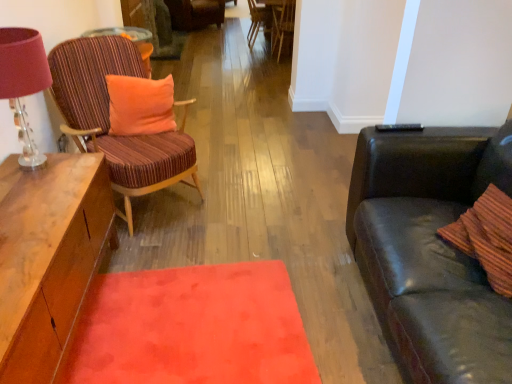
Describe the element at coordinates (195, 13) in the screenshot. I see `velvet striped chair at center, acting as the 1th chair starting from the back` at that location.

You are a GUI agent. You are given a task and a screenshot of the screen. Output one action in this format:
    pyautogui.click(x=<x>, y=<y>)
    Task: Click on the matte wood desk at upper left
    
    Given the screenshot: What is the action you would take?
    coord(130,40)

This screenshot has width=512, height=384. Describe the element at coordinates (109, 120) in the screenshot. I see `striped fabric chair at left, the 4th chair when ordered from back to front` at that location.

The height and width of the screenshot is (384, 512). What do you see at coordinates (140, 105) in the screenshot?
I see `orange plush pillow at left` at bounding box center [140, 105].

This screenshot has height=384, width=512. I want to click on orange plush pillow at left, so click(x=140, y=105).

Locate an element on the screen. The width and height of the screenshot is (512, 384). velvety orange mat at center is located at coordinates (193, 328).

In the scene shown: Does matte pink lampshade at left have a smaller size compared to wooden chair at center, marked as the 3th chair in a bottom-to-top arrangement?

Correct, matte pink lampshade at left occupies less space than wooden chair at center, marked as the 3th chair in a bottom-to-top arrangement.

Considering the sizes of matte pink lampshade at left and wooden chair at center, the second chair viewed from the top, in the image, is matte pink lampshade at left wider or thinner than wooden chair at center, the second chair viewed from the top,?

In the image, matte pink lampshade at left appears to be more narrow than wooden chair at center, the second chair viewed from the top.

How many degrees apart are the facing directions of matte pink lampshade at left and wooden chair at center, the second chair viewed from the top?

The angle between the facing direction of matte pink lampshade at left and the facing direction of wooden chair at center, the second chair viewed from the top, is 0.418 degrees.

Considering the sizes of objects matte pink lampshade at left and wooden chair at center, the second chair viewed from the top, in the image provided, who is taller, matte pink lampshade at left or wooden chair at center, the second chair viewed from the top,?

wooden chair at center, the second chair viewed from the top, is taller.

Which point is more forward, (119, 143) or (165, 126)?

Positioned in front is point (119, 143).

Find the location of `chair in front of the orange plush pillow at left`. chair in front of the orange plush pillow at left is located at coordinates (109, 120).

From a real-world perspective, is striped fabric chair at left, the 4th chair when ordered from top to bottom, above or below orange plush pillow at left?

From a real-world perspective, striped fabric chair at left, the 4th chair when ordered from top to bottom, is physically below orange plush pillow at left.

Is striped fabric chair at left, the 4th chair when ordered from top to bottom, with orange plush pillow at left?

No, striped fabric chair at left, the 4th chair when ordered from top to bottom, is not touching orange plush pillow at left.

Considering the relative positions of striped fabric chair at left, the 4th chair when ordered from back to front, and matte pink lampshade at left in the image provided, is striped fabric chair at left, the 4th chair when ordered from back to front, to the left of matte pink lampshade at left from the viewer's perspective?

Incorrect, striped fabric chair at left, the 4th chair when ordered from back to front, is not on the left side of matte pink lampshade at left.

Could you tell me if striped fabric chair at left, the 4th chair when ordered from top to bottom, is facing matte pink lampshade at left?

No, striped fabric chair at left, the 4th chair when ordered from top to bottom, is not oriented towards matte pink lampshade at left.

Considering the sizes of striped fabric chair at left, the 4th chair when ordered from top to bottom, and matte pink lampshade at left in the image, is striped fabric chair at left, the 4th chair when ordered from top to bottom, taller or shorter than matte pink lampshade at left?

Considering their sizes, striped fabric chair at left, the 4th chair when ordered from top to bottom, has more height than matte pink lampshade at left.

From the image's perspective, does striped fabric chair at left, the 4th chair when ordered from top to bottom, appear higher than matte pink lampshade at left?

Yes, from the image's perspective, striped fabric chair at left, the 4th chair when ordered from top to bottom, is on top of matte pink lampshade at left.

Is point (214, 11) positioned in front of point (277, 17)?

No, it is not.

Measure the distance between velvet striped chair at center, arranged as the first chair when viewed from the top, and wooden chair at center, the 2th chair from the bottom.

A distance of 7.74 feet exists between velvet striped chair at center, arranged as the first chair when viewed from the top, and wooden chair at center, the 2th chair from the bottom.

In terms of height, does velvet striped chair at center, placed as the fourth chair when sorted from front to back, look taller or shorter compared to wooden chair at center, the 2th chair from the bottom?

Clearly, velvet striped chair at center, placed as the fourth chair when sorted from front to back, is shorter compared to wooden chair at center, the 2th chair from the bottom.

Is velvet striped chair at center, the fourth chair positioned from the bottom, oriented away from wooden chair at center, arranged as the 2th chair when viewed from the front?

No, wooden chair at center, arranged as the 2th chair when viewed from the front, is not at the back of velvet striped chair at center, the fourth chair positioned from the bottom.

Considering the positions of objects wooden chair at center, the 3th chair from the back, and wooden chair at center, positioned as the 2th chair in back-to-front order, in the image provided, who is more to the right, wooden chair at center, the 3th chair from the back, or wooden chair at center, positioned as the 2th chair in back-to-front order,?

Positioned to the right is wooden chair at center, the 3th chair from the back.

Is wooden chair at center, the 3th chair from the back, taller than wooden chair at center, the second chair viewed from the top?

Indeed, wooden chair at center, the 3th chair from the back, has a greater height compared to wooden chair at center, the second chair viewed from the top.

Would you say wooden chair at center, the 2th chair from the bottom, is inside or outside wooden chair at center, the second chair viewed from the top?

wooden chair at center, the 2th chair from the bottom, lies outside wooden chair at center, the second chair viewed from the top.

Looking at this image, is wooden chair at center, the 2th chair from the bottom, wider or thinner than wooden chair at center, positioned as the 2th chair in back-to-front order?

In the image, wooden chair at center, the 2th chair from the bottom, appears to be wider than wooden chair at center, positioned as the 2th chair in back-to-front order.

Is velvet striped chair at center, placed as the fourth chair when sorted from front to back, at the back of wooden chair at center, arranged as the 2th chair when viewed from the front?

That's not correct — wooden chair at center, arranged as the 2th chair when viewed from the front, is not looking away from velvet striped chair at center, placed as the fourth chair when sorted from front to back.

Is the surface of wooden chair at center, arranged as the 2th chair when viewed from the front, in direct contact with velvet striped chair at center, the fourth chair positioned from the bottom?

No, wooden chair at center, arranged as the 2th chair when viewed from the front, is not in contact with velvet striped chair at center, the fourth chair positioned from the bottom.

Does wooden chair at center, the 3th chair from the back, have a smaller size compared to velvet striped chair at center, the fourth chair positioned from the bottom?

A: Correct, wooden chair at center, the 3th chair from the back, occupies less space than velvet striped chair at center, the fourth chair positioned from the bottom.

Between point (293, 1) and point (167, 1), which one is positioned in front?

The point (293, 1) is more forward.

Is wooden chair at center, the 2th chair from the bottom, positioned in front of orange plush pillow at left?

That is False.

From the image's perspective, is wooden chair at center, arranged as the 2th chair when viewed from the front, under orange plush pillow at left?

Incorrect, from the image's perspective, wooden chair at center, arranged as the 2th chair when viewed from the front, is higher than orange plush pillow at left.

Consider the image. Is orange plush pillow at left inside wooden chair at center, which ranks as the third chair in top-to-bottom order?

No.

Measure the distance between wooden chair at center, arranged as the 2th chair when viewed from the front, and orange plush pillow at left.

They are 2.75 meters apart.

At what (x,y) coordinates should I click in order to perform the action: click on the 3rd chair above the matte pink lampshade at left (from the image's perspective). Please return your answer as a coordinate pair (x, y). Looking at the image, I should click on (258, 21).

Where is `pillow above the striped fabric chair at left, the 4th chair when ordered from top to bottom (from a real-world perspective)`? pillow above the striped fabric chair at left, the 4th chair when ordered from top to bottom (from a real-world perspective) is located at coordinates (140, 105).

When comparing their distances from wooden chair at center, arranged as the 2th chair when viewed from the front, does wooden chair at center, marked as the 3th chair in a bottom-to-top arrangement, or matte pink lampshade at left seem further?

Among the two, matte pink lampshade at left is located further to wooden chair at center, arranged as the 2th chair when viewed from the front.

Estimate the real-world distances between objects in this image. Which object is closer to orange plush pillow at left, matte wood desk at upper left or wooden chair at center, the 2th chair from the bottom?

matte wood desk at upper left is positioned closer to the anchor orange plush pillow at left.

Considering their positions, is matte wood desk at upper left positioned further to velvet striped chair at center, placed as the fourth chair when sorted from front to back, than striped fabric chair at left, the 1th chair in the bottom-to-top sequence?

striped fabric chair at left, the 1th chair in the bottom-to-top sequence.

Considering their positions, is striped fabric chair at left, which is the first chair in front-to-back order, positioned closer to wooden chair at center, which ranks as the third chair in top-to-bottom order, than matte pink lampshade at left?

striped fabric chair at left, which is the first chair in front-to-back order, is closer to wooden chair at center, which ranks as the third chair in top-to-bottom order.

Which object lies further to the anchor point striped fabric chair at left, which is the first chair in front-to-back order, wooden chair at center, the second chair viewed from the top, or wooden chair at center, the 3th chair from the back?

wooden chair at center, the second chair viewed from the top, lies further to striped fabric chair at left, which is the first chair in front-to-back order, than the other object.

From the image, which object appears to be nearer to velvety orange mat at center, wooden chair at center, the 2th chair from the bottom, or orange plush pillow at left?

orange plush pillow at left is positioned closer to the anchor velvety orange mat at center.

Which object lies further to the anchor point matte pink lampshade at left, wooden chair at center, the 2th chair from the bottom, or velvety orange mat at center?

The object further to matte pink lampshade at left is wooden chair at center, the 2th chair from the bottom.

Consider the image. From the image, which object appears to be nearer to matte wood desk at upper left, striped fabric chair at left, the 4th chair when ordered from top to bottom, or velvet striped chair at center, acting as the 1th chair starting from the back?

striped fabric chair at left, the 4th chair when ordered from top to bottom.

Locate an element on the screen. Image resolution: width=512 pixels, height=384 pixels. lamp that lies between striped fabric chair at left, which is the first chair in front-to-back order, and velvety orange mat at center from top to bottom is located at coordinates (23, 83).

Find the location of a particular element. Image resolution: width=512 pixels, height=384 pixels. chair positioned between velvety orange mat at center and wooden chair at center, the 3th chair from the back, from near to far is located at coordinates (109, 120).

Image resolution: width=512 pixels, height=384 pixels. What are the coordinates of `pillow between matte pink lampshade at left and velvet striped chair at center, the fourth chair positioned from the bottom, along the z-axis` in the screenshot? It's located at (140, 105).

Locate an element on the screen. The height and width of the screenshot is (384, 512). desk positioned between velvety orange mat at center and velvet striped chair at center, arranged as the first chair when viewed from the top, from near to far is located at coordinates (130, 40).